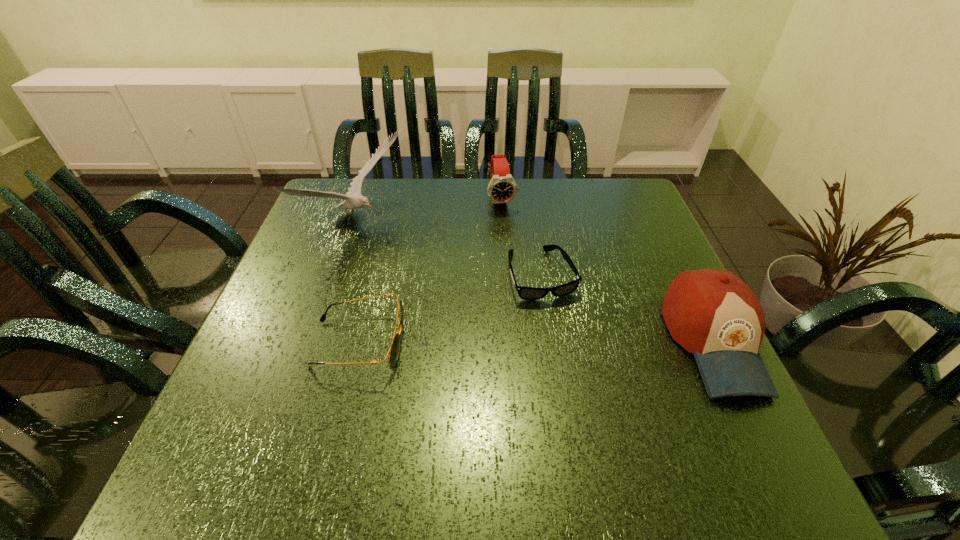
I want to click on vacant spot on the desktop that is between the nearer sunglasses and the baseball cap and is positioned on the face of the watch, so click(540, 342).

Where is `free space on the desktop that is between the nearer sunglasses and the rightmost object and is positioned on the front-facing side of the right sunglasses`? This screenshot has height=540, width=960. free space on the desktop that is between the nearer sunglasses and the rightmost object and is positioned on the front-facing side of the right sunglasses is located at coordinates (569, 342).

At what (x,y) coordinates should I click in order to perform the action: click on vacant space on the desktop that is between the nearer sunglasses and the rightmost object and is positioned at the tip of the beak of the gull. Please return your answer as a coordinate pair (x, y). The image size is (960, 540). Looking at the image, I should click on (566, 342).